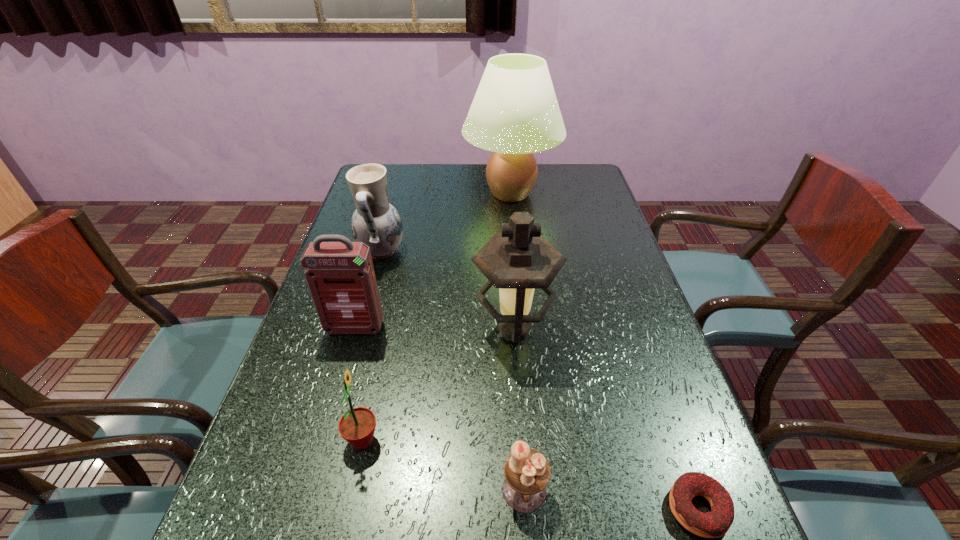
The image size is (960, 540). I want to click on the fifth closest object relative to the pottery, so click(527, 472).

Where is `free region that satisfies the following two spatial constraints: 1. on either side of the second farthest object; 2. on the front-facing side of the first-aid kit`? The width and height of the screenshot is (960, 540). free region that satisfies the following two spatial constraints: 1. on either side of the second farthest object; 2. on the front-facing side of the first-aid kit is located at coordinates (360, 328).

Where is `vacant space that satisfies the following two spatial constraints: 1. on either side of the sixth nearest object; 2. on the back side of the oil lamp`? vacant space that satisfies the following two spatial constraints: 1. on either side of the sixth nearest object; 2. on the back side of the oil lamp is located at coordinates (360, 329).

Find the location of a particular element. The height and width of the screenshot is (540, 960). free space that satisfies the following two spatial constraints: 1. on either side of the oil lamp; 2. on the right side of the pottery is located at coordinates (360, 329).